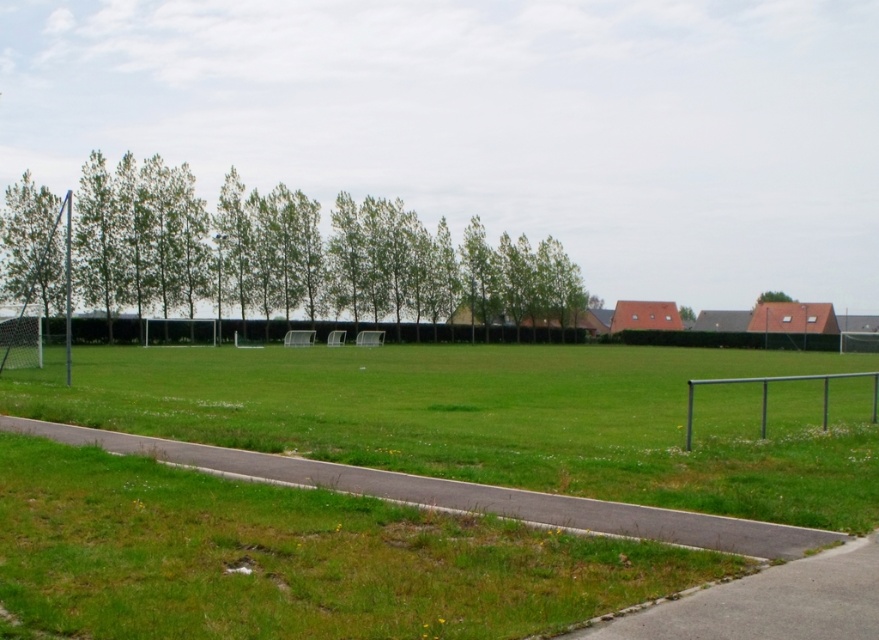
You are planning to plant a new tree in this area. Considering the existing green leafy tree at left and the green leafy tree at upper right, which one requires more space due to its width?

The green leafy tree at left might be wider than green leafy tree at upper right, so it requires more space due to its width.